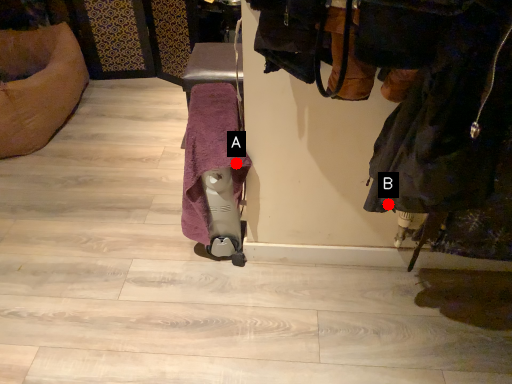
Question: Two points are circled on the image, labeled by A and B beside each circle. Among these points, which one is nearest to the camera?

Choices:
 (A) A is closer
 (B) B is closer

Answer: (B)